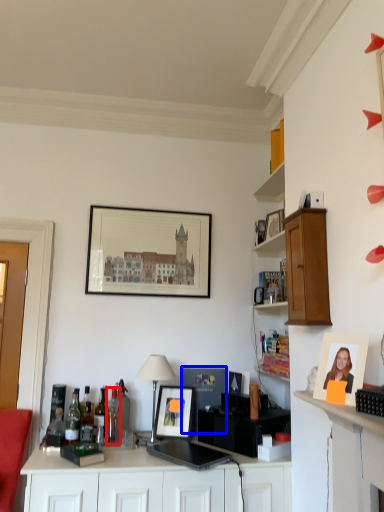
Question: Which object appears farthest to the camera in this image, bottle (highlighted by a red box) or picture frame (highlighted by a blue box)?

Choices:
 (A) bottle
 (B) picture frame

Answer: (B)